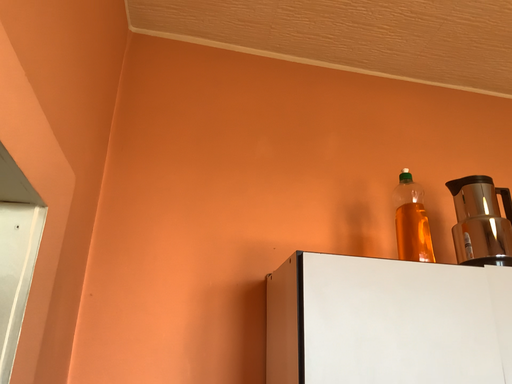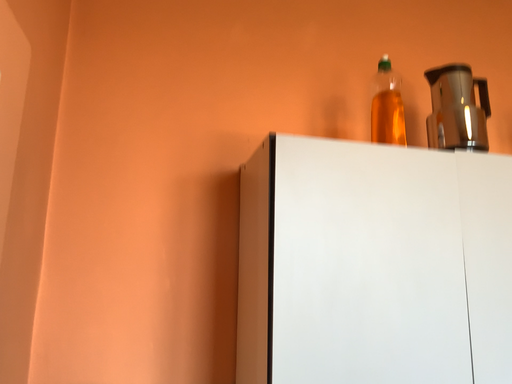
Question: Which way did the camera rotate in the video?

Choices:
 (A) rotated upward
 (B) rotated downward

Answer: (B)